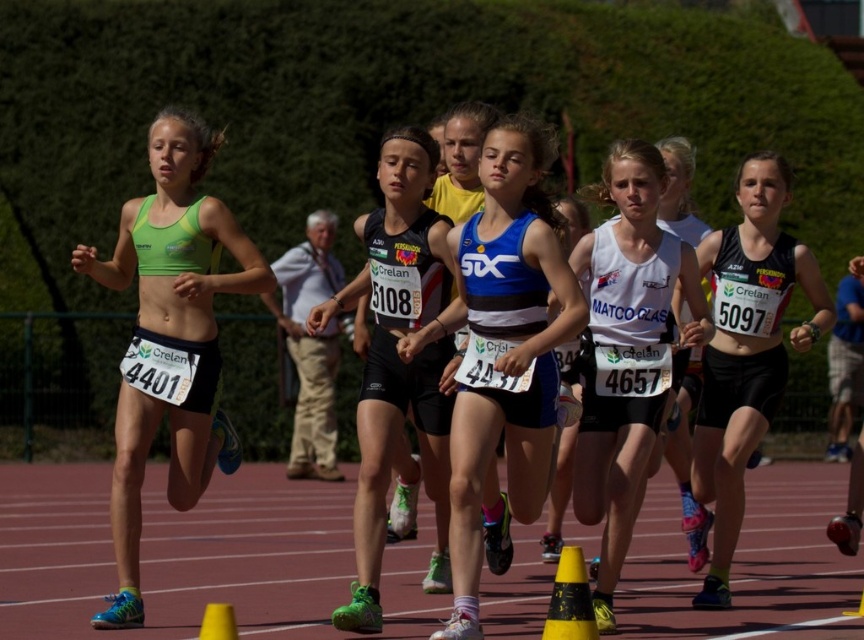
Question: Among these objects, which one is farthest from the camera?

Choices:
 (A) green matte sports bra at left
 (B) yellow plastic cone at lower right
 (C) white matte tank top at center

Answer: (A)

Question: Which point is closer to the camera taking this photo?

Choices:
 (A) (558, 292)
 (B) (632, 144)

Answer: (A)

Question: Does white matte tank top at center appear under yellow plastic cone at lower center?

Choices:
 (A) no
 (B) yes

Answer: (A)

Question: Among these points, which one is nearest to the camera?

Choices:
 (A) (373, 620)
 (B) (147, 198)

Answer: (A)

Question: Does black matte tank top at center have a lesser width compared to yellow plastic cone at lower right?

Choices:
 (A) no
 (B) yes

Answer: (A)

Question: Can you confirm if blue matte tank top at center is bigger than yellow plastic cone at lower center?

Choices:
 (A) no
 (B) yes

Answer: (B)